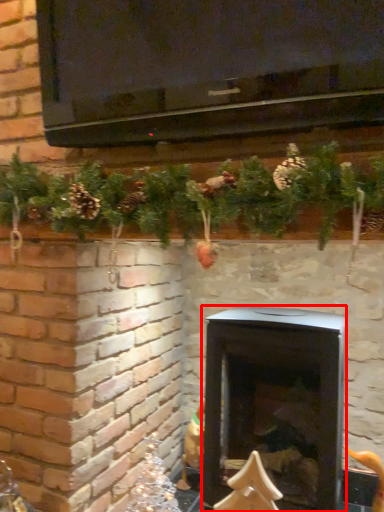
Question: From the image's perspective, considering the relative positions of wood burning stove (annotated by the red box) and christmas decoration in the image provided, where is wood burning stove (annotated by the red box) located with respect to the staircase?

Choices:
 (A) below
 (B) above

Answer: (B)